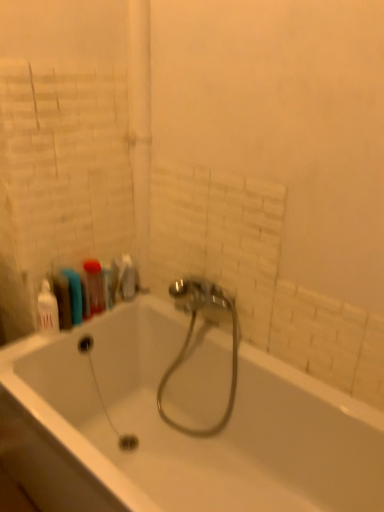
Question: In terms of height, does shiny chrome faucet at center look taller or shorter compared to translucent plastic bottle at left?

Choices:
 (A) tall
 (B) short

Answer: (A)

Question: Is shiny chrome faucet at center bigger or smaller than translucent plastic bottle at left?

Choices:
 (A) big
 (B) small

Answer: (A)

Question: Which of these objects is positioned closest to the white glossy bathtub at center?

Choices:
 (A) white glossy bottle at left, the second toiletry from the right
 (B) translucent plastic bottle at left
 (C) translucent plastic toothbrush at upper left, marked as the 2th toiletry in a left-to-right arrangement
 (D) shiny chrome faucet at center

Answer: (D)

Question: Based on their relative distances, which object is nearer to the translucent plastic toothbrush at upper left, which is the 1th toiletry in back-to-front order?

Choices:
 (A) white glossy bottle at left, the first toiletry in the left-to-right sequence
 (B) shiny chrome faucet at center
 (C) white glossy bathtub at center
 (D) translucent plastic bottle at left

Answer: (D)